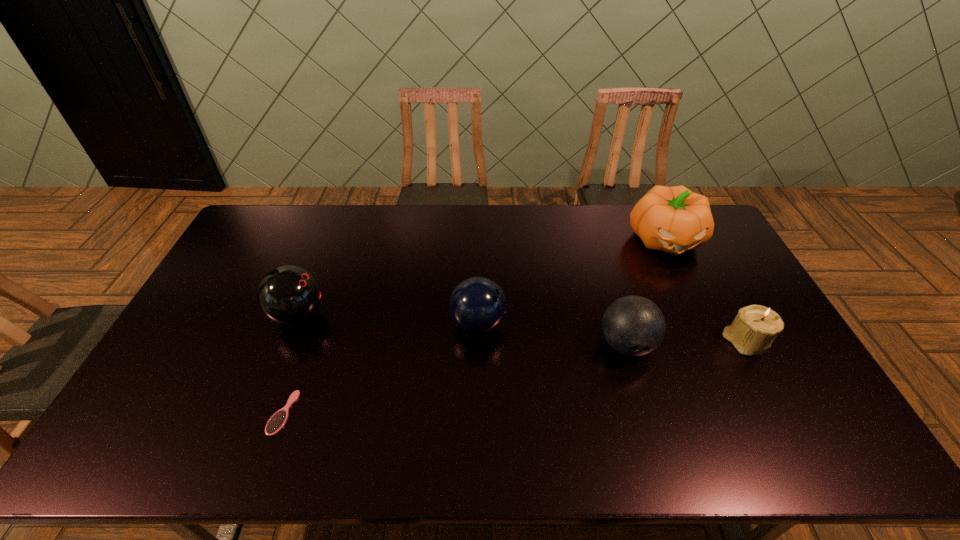
Choose which object is the fourth nearest neighbor to the rightmost bowling ball. Please provide its 2D coordinates. Your answer should be formatted as a tuple, i.e. [(x, y)], where the tuple contains the x and y coordinates of a point satisfying the conditions above.

[(288, 295)]

Identify which bowling ball is the second nearest to the leftmost bowling ball. Please provide its 2D coordinates. Your answer should be formatted as a tuple, i.e. [(x, y)], where the tuple contains the x and y coordinates of a point satisfying the conditions above.

[(633, 325)]

Select which bowling ball appears as the second closest to the rightmost bowling ball. Please provide its 2D coordinates. Your answer should be formatted as a tuple, i.e. [(x, y)], where the tuple contains the x and y coordinates of a point satisfying the conditions above.

[(288, 295)]

I want to click on free space that satisfies the following two spatial constraints: 1. on the surface of the leftmost bowling ball near the finger holes; 2. on the right side of the candle_holder, so click(288, 342).

Where is `blank space that satisfies the following two spatial constraints: 1. on the carved face of the pumpkin; 2. on the surface of the fourth object from right to left near the finger holes`? This screenshot has height=540, width=960. blank space that satisfies the following two spatial constraints: 1. on the carved face of the pumpkin; 2. on the surface of the fourth object from right to left near the finger holes is located at coordinates (706, 323).

Where is `free location that satisfies the following two spatial constraints: 1. on the surface of the leftmost bowling ball near the finger holes; 2. on the back side of the shortest object`? This screenshot has width=960, height=540. free location that satisfies the following two spatial constraints: 1. on the surface of the leftmost bowling ball near the finger holes; 2. on the back side of the shortest object is located at coordinates (260, 413).